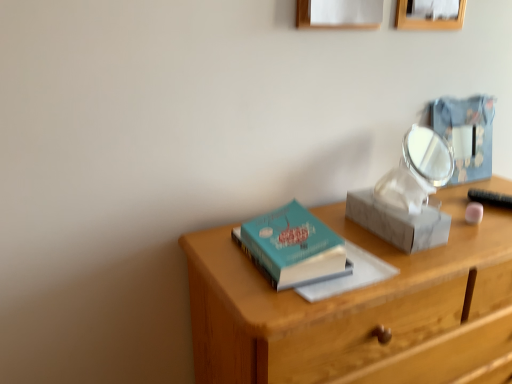
This screenshot has width=512, height=384. I want to click on vacant area that is in front of metallic blue box at upper right, so click(473, 195).